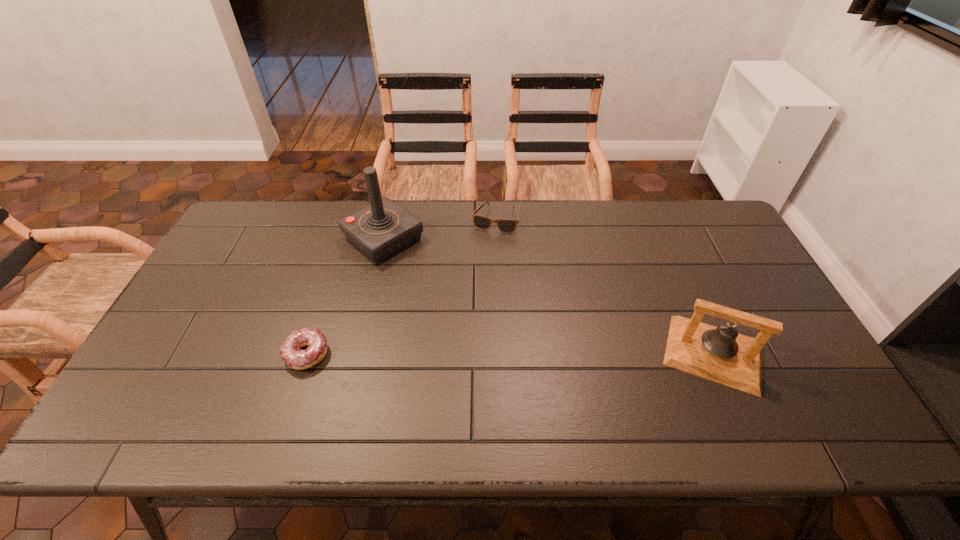
At what (x,y) coordinates should I click in order to perform the action: click on vacant space at the near edge. Please return your answer as a coordinate pair (x, y). The width and height of the screenshot is (960, 540). Looking at the image, I should click on (213, 389).

In the image, there is a desktop. Identify the location of vacant region at the left edge. This screenshot has height=540, width=960. (197, 325).

Where is `free space at the far left corner of the desktop`? The image size is (960, 540). free space at the far left corner of the desktop is located at coordinates (251, 217).

You are a GUI agent. You are given a task and a screenshot of the screen. Output one action in this format:
    pyautogui.click(x=<x>, y=<y>)
    Task: Click on the free spot between the tallest object and the third object from left to right
    The height and width of the screenshot is (540, 960).
    Given the screenshot: What is the action you would take?
    pos(439,229)

This screenshot has height=540, width=960. Find the location of `free space between the doughnut and the second object from right to left`. free space between the doughnut and the second object from right to left is located at coordinates (400, 287).

Find the location of a particular element. The width and height of the screenshot is (960, 540). vacant space in between the doughnut and the second tallest object is located at coordinates (510, 354).

At what (x,y) coordinates should I click in order to perform the action: click on free area in between the joystick and the sunglasses. Please return your answer as a coordinate pair (x, y). The image size is (960, 540). Looking at the image, I should click on (439, 229).

Locate an element on the screen. empty location between the rightmost object and the doughnut is located at coordinates (510, 354).

Locate an element on the screen. free space between the tallest object and the rightmost object is located at coordinates (548, 296).

Locate an element on the screen. empty location between the third object from left to right and the rightmost object is located at coordinates (604, 287).